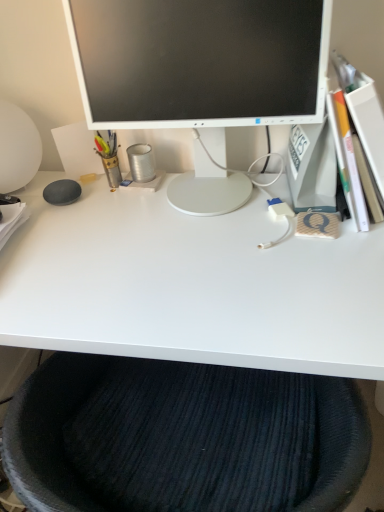
Identify the location of vacant space to the right of metallic canister at center, the second stationery in the left-to-right sequence. The width and height of the screenshot is (384, 512). (201, 184).